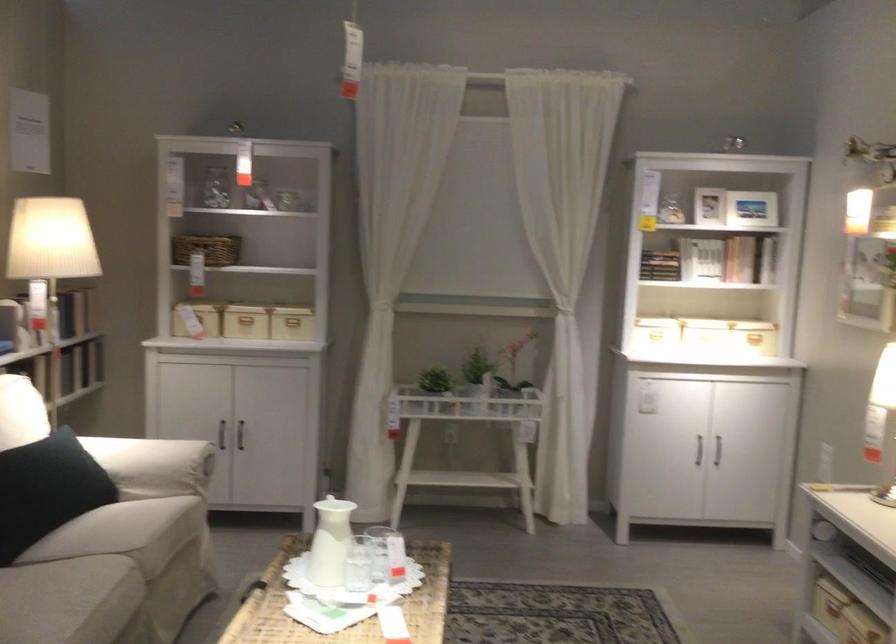
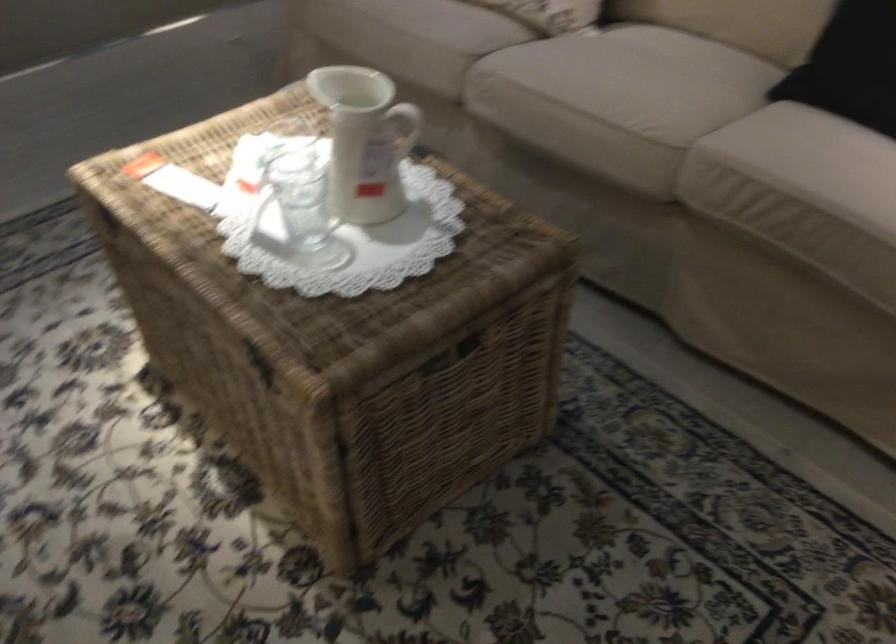
Where in the second image is the point corresponding to (x=340, y=533) from the first image?

(365, 140)